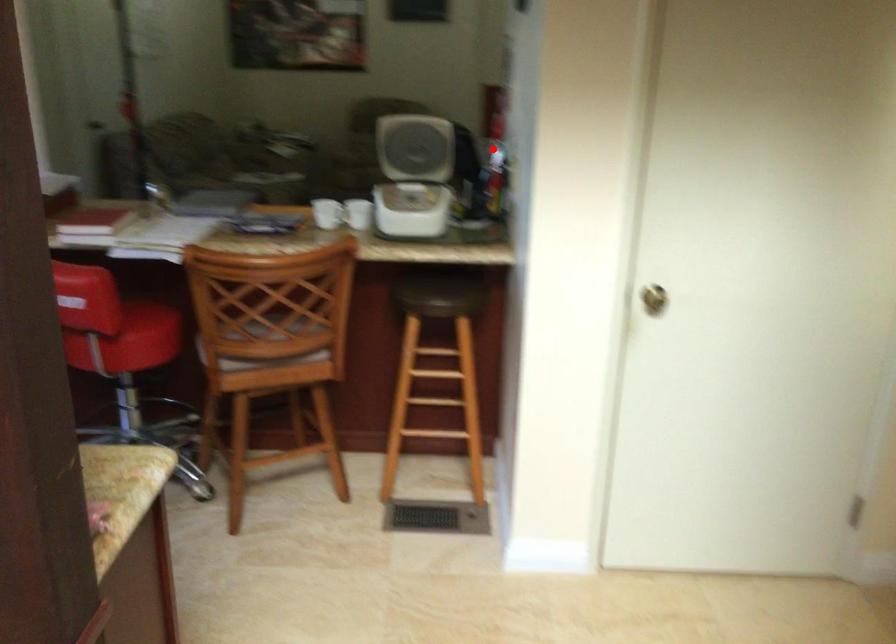
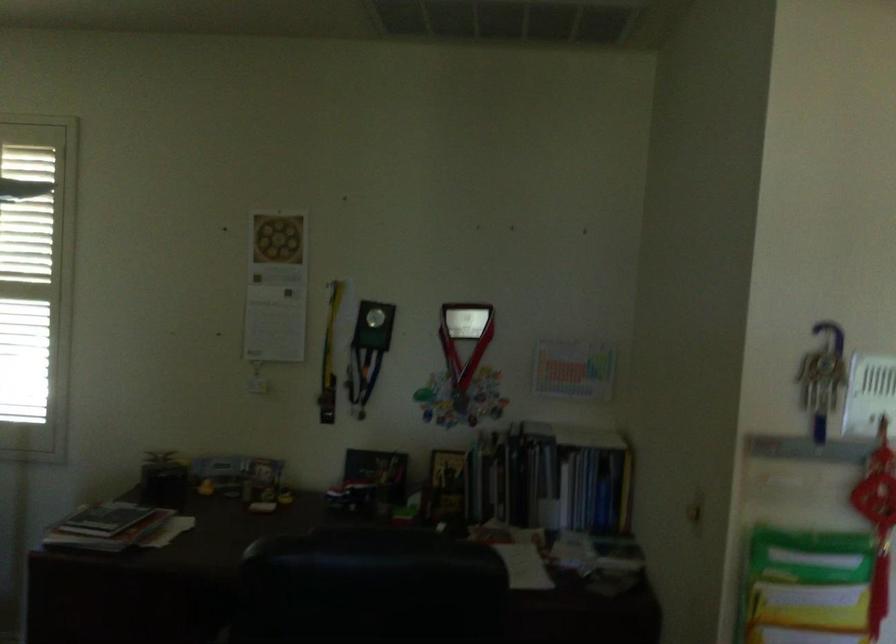
Question: I am providing you with two images of the same scene from different viewpoints. Image1 has a red point marked. In image2, the corresponding 3D location appears at what relative position? Reply with the corresponding letter.

Choices:
 (A) Closer
 (B) Farther

Answer: (A)